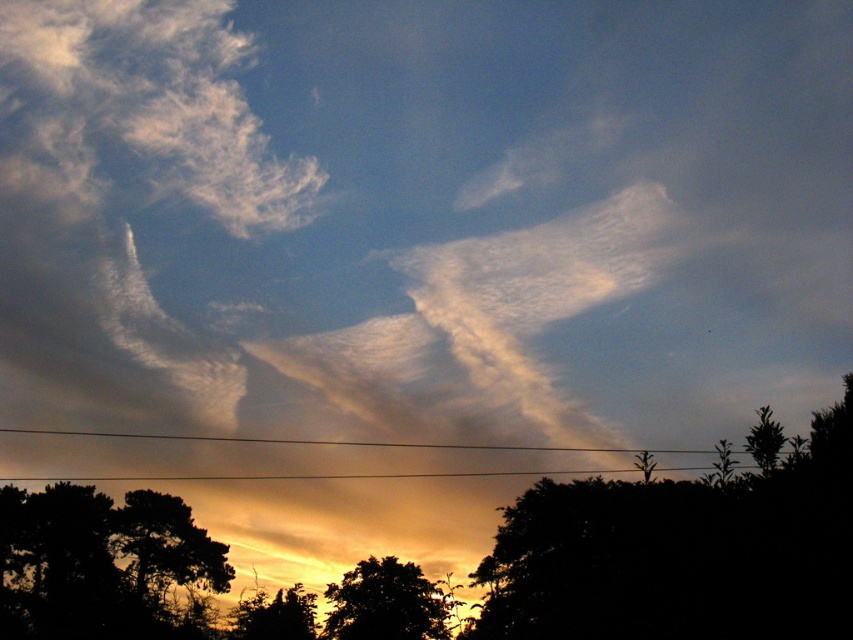
Is silhouette tree at lower left taller than metallic wire at bottom center?

Incorrect, silhouette tree at lower left's height is not larger of metallic wire at bottom center's.

Locate an element on the screen. This screenshot has height=640, width=853. silhouette tree at lower left is located at coordinates (166, 547).

The height and width of the screenshot is (640, 853). I want to click on silhouette tree at lower left, so click(166, 547).

The height and width of the screenshot is (640, 853). What do you see at coordinates (682, 554) in the screenshot?
I see `silhouette leafy tree at lower right` at bounding box center [682, 554].

Between silhouette leafy tree at lower right and silhouette tree at lower left, which one is positioned lower?

Positioned lower is silhouette tree at lower left.

Identify the location of silhouette leafy tree at lower right. The image size is (853, 640). (682, 554).

Which of these two, silhouette tree at lower left or silhouette leafy tree at lower center, stands taller?

silhouette tree at lower left is taller.

Is silhouette tree at lower left shorter than silhouette leafy tree at lower center?

Incorrect, silhouette tree at lower left's height does not fall short of silhouette leafy tree at lower center's.

Locate an element on the screen. The image size is (853, 640). silhouette tree at lower left is located at coordinates (166, 547).